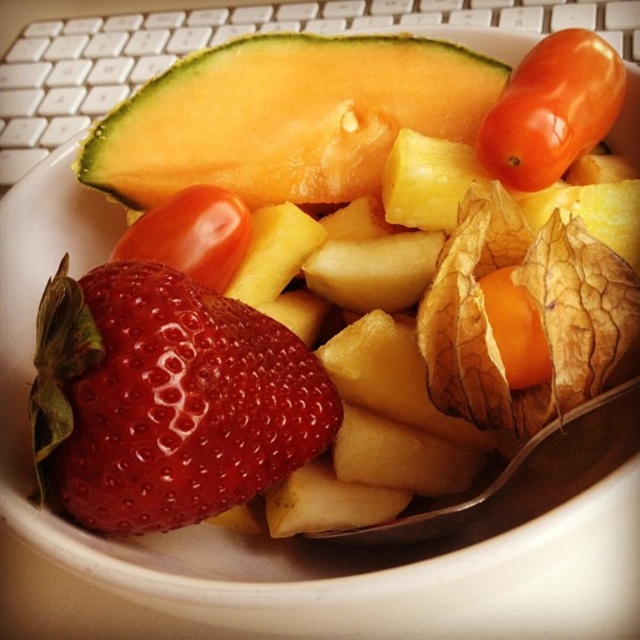
Between point (196, 216) and point (506, 291), which one is positioned behind?

Point (196, 216)

Image resolution: width=640 pixels, height=640 pixels. Identify the location of glossy tomato at center. (193, 236).

The image size is (640, 640). I want to click on glossy tomato at center, so tap(193, 236).

Can you confirm if yellowish-green textured cantaloupe at upper left is taller than glossy tomato at center?

Yes, yellowish-green textured cantaloupe at upper left is taller than glossy tomato at center.

Does yellowish-green textured cantaloupe at upper left lie behind glossy tomato at center?

Yes, yellowish-green textured cantaloupe at upper left is further from the viewer.

Between point (321, 164) and point (157, 260), which one is positioned in front?

Point (157, 260) is more forward.

I want to click on yellowish-green textured cantaloupe at upper left, so click(x=285, y=116).

Is shiny red strawberry at center-left to the right of glossy tomato at center from the viewer's perspective?

Yes, shiny red strawberry at center-left is to the right of glossy tomato at center.

Who is more distant from viewer, (129, 512) or (192, 273)?

Point (192, 273)

Between point (301, 406) and point (220, 241), which one is positioned behind?

Positioned behind is point (220, 241).

This screenshot has height=640, width=640. I want to click on shiny red strawberry at center-left, so click(166, 400).